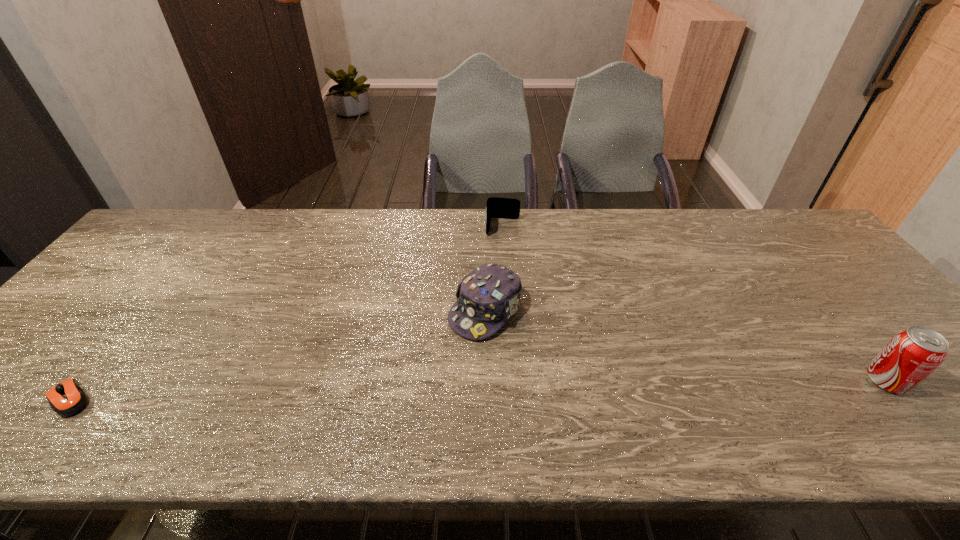
This screenshot has height=540, width=960. In order to click on computer mouse in this screenshot , I will do `click(67, 398)`.

Where is `the leftmost object`? the leftmost object is located at coordinates (67, 398).

Locate an element on the screen. The image size is (960, 540). the tallest object is located at coordinates pos(913,354).

Where is `soda`? soda is located at coordinates (913, 354).

Find the location of a particular element. The height and width of the screenshot is (540, 960). the farthest object is located at coordinates (506, 208).

Where is `the third tallest object`? the third tallest object is located at coordinates (506, 208).

Find the location of `the third nearest object`. the third nearest object is located at coordinates (487, 297).

At what (x,y) coordinates should I click in order to perform the action: click on headwear. Please return your answer as a coordinate pair (x, y). This screenshot has height=540, width=960. Looking at the image, I should click on (487, 297).

Locate an element on the screen. This screenshot has width=960, height=540. vacant space located 0.170m on the back of the computer mouse is located at coordinates (129, 323).

The height and width of the screenshot is (540, 960). Identify the location of vacant space located on the back of the soda. (832, 315).